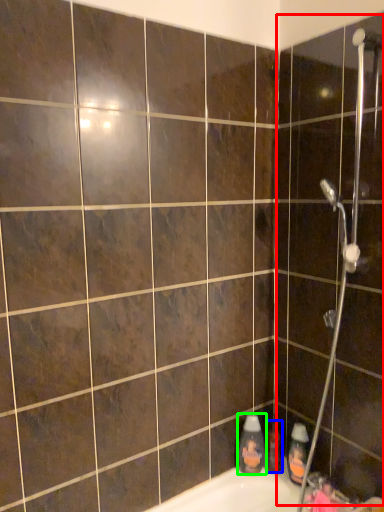
Question: Estimate the real-world distances between objects in this image. Which object is farther from screen door (highlighted by a red box), toiletry (highlighted by a blue box) or cleaning product (highlighted by a green box)?

Choices:
 (A) toiletry
 (B) cleaning product

Answer: (A)